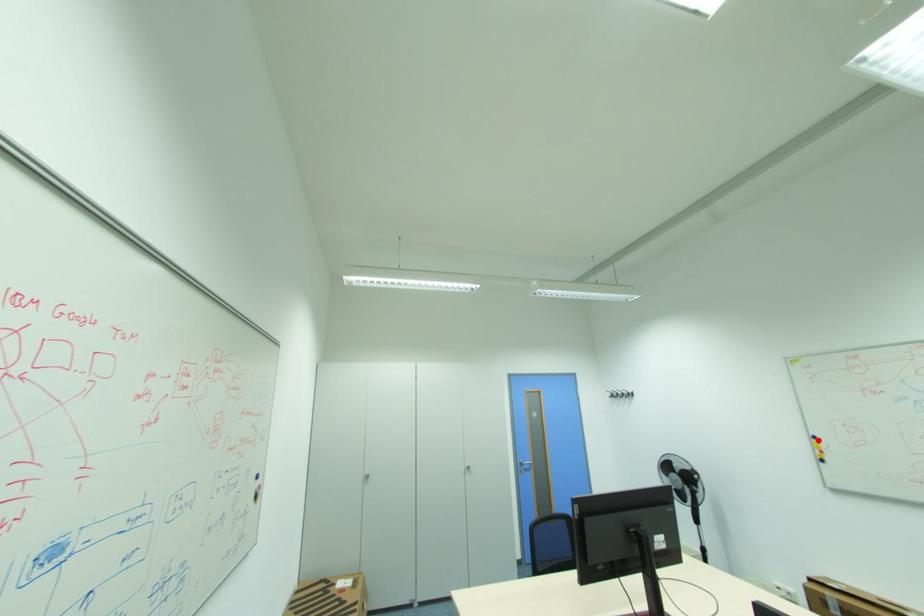
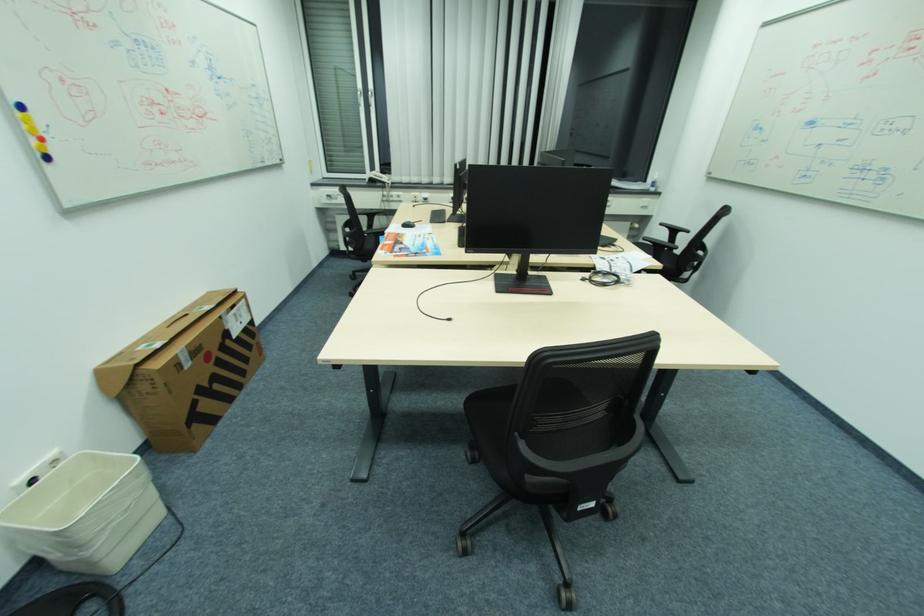
Question: A red point is marked in image1. In image2, is the corresponding 3D point closer to the camera or farther? Reply with the corresponding letter.

Choices:
 (A) The corresponding 3D point is closer.
 (B) The corresponding 3D point is farther.

Answer: (B)